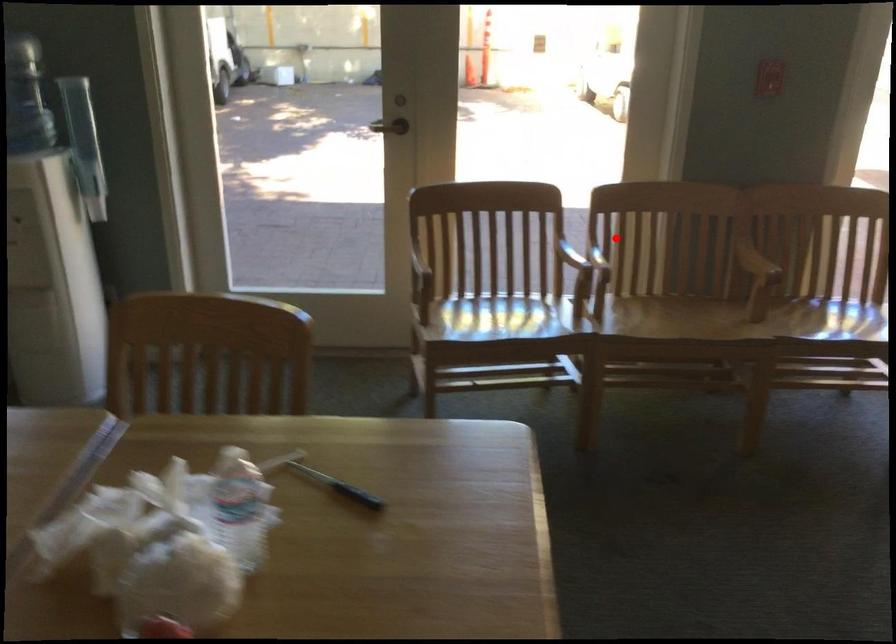
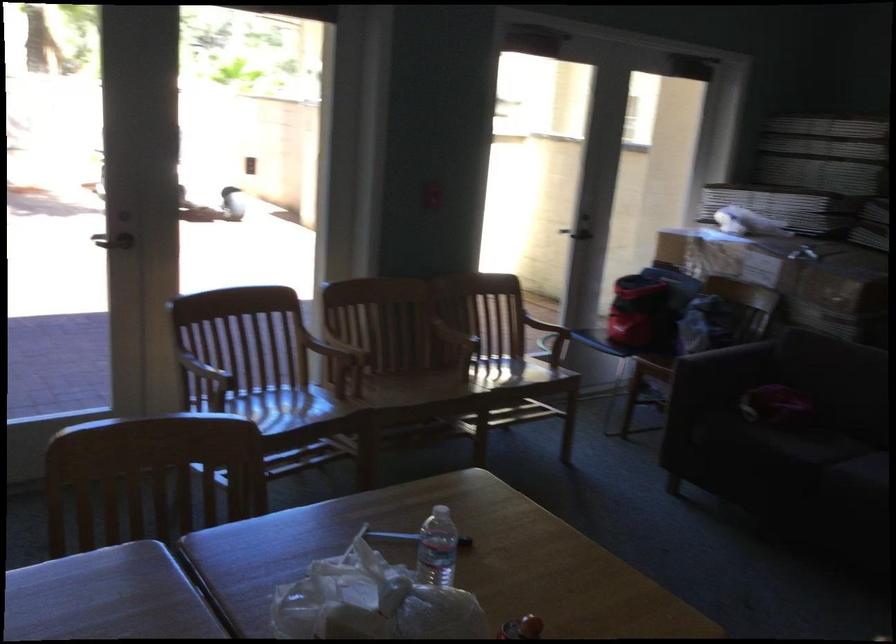
Locate, in the second image, the point that corresponds to the highlighted location in the first image.

(340, 333)